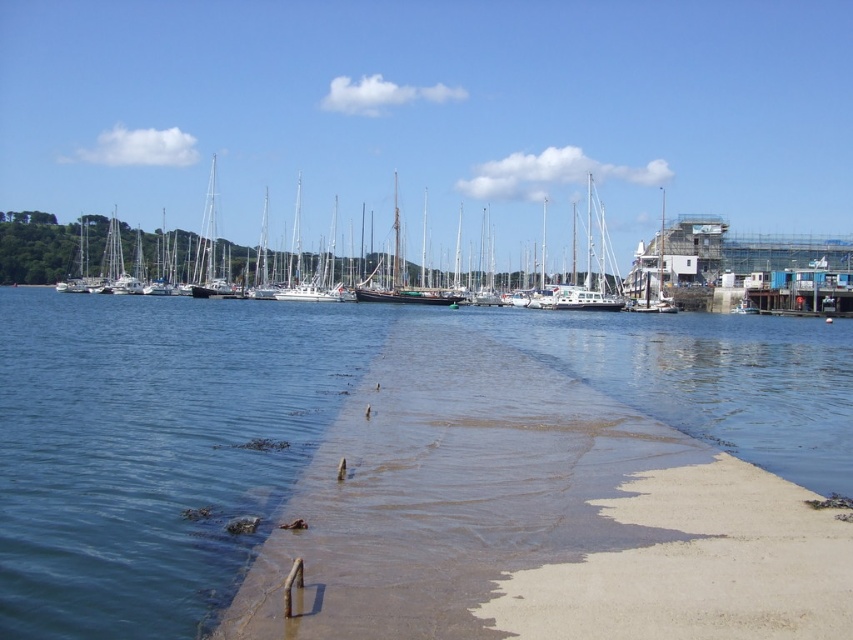
You are standing on the sandy jetty and see the clear water at lower left and the wooden sailboat at center. Which object is closer to the water surface?

The wooden sailboat at center is closer to the water surface because the clear water at lower left is below it.

You are standing at the edge of the marina and want to place a small wooden post exactly at the sandy concrete at center. According to the coordinates provided, where should you place it?

The sandy concrete at center should be placed at coordinates point [567,490] as specified in the description.